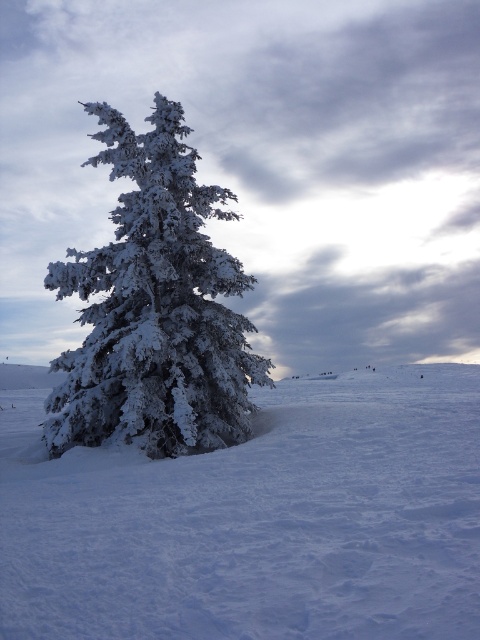
Question: Which object is closer to the camera taking this photo?

Choices:
 (A) white fluffy snow at center
 (B) white frosty tree at center

Answer: (A)

Question: Which of the following is the farthest from the observer?

Choices:
 (A) (115, 413)
 (B) (468, 449)

Answer: (A)

Question: Is the position of white fluffy snow at center more distant than that of white frosty tree at center?

Choices:
 (A) yes
 (B) no

Answer: (B)

Question: Is white fluffy snow at center thinner than white frosty tree at center?

Choices:
 (A) yes
 (B) no

Answer: (B)

Question: Can you confirm if white fluffy snow at center is positioned to the right of white frosty tree at center?

Choices:
 (A) no
 (B) yes

Answer: (B)